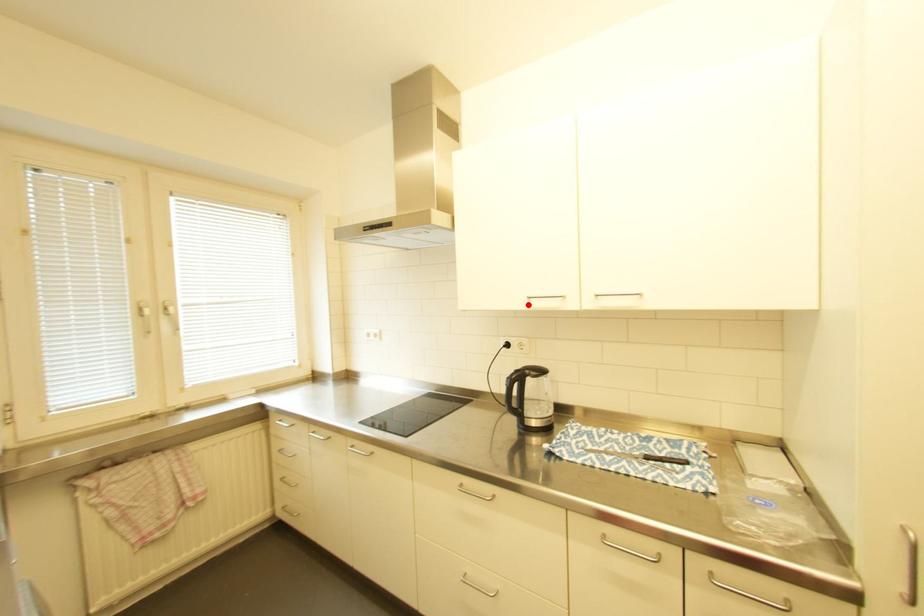
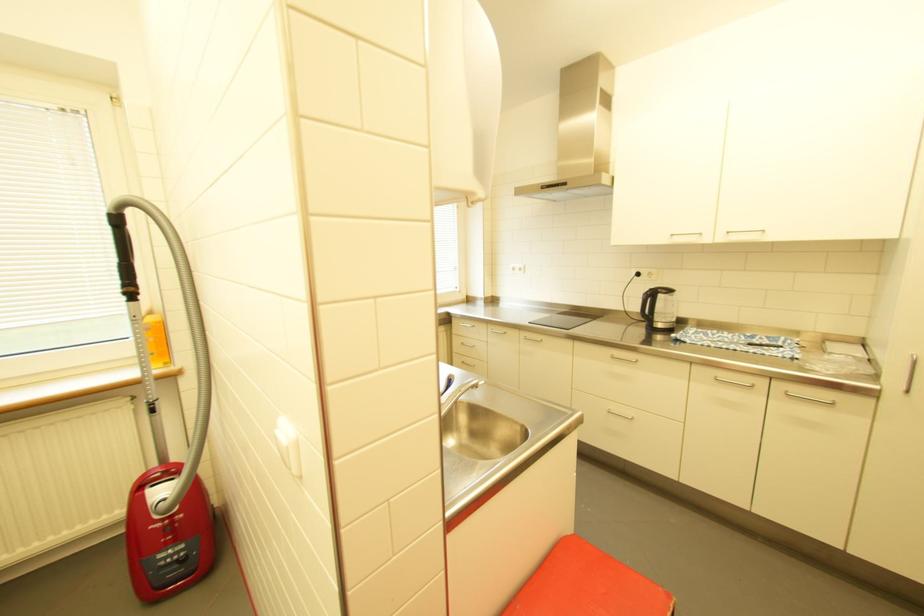
Locate, in the second image, the point that corresponds to the highlighted location in the first image.

(671, 241)